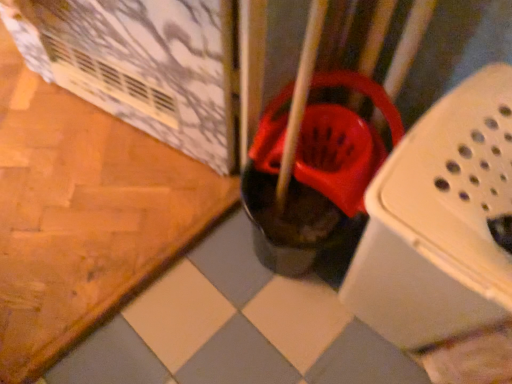
This screenshot has height=384, width=512. I want to click on white plastic laundry basket at center, so click(440, 221).

Describe the element at coordinates (440, 221) in the screenshot. I see `white plastic laundry basket at center` at that location.

In order to click on rubberized red bucket at center in this screenshot , I will do `click(308, 182)`.

Measure the distance between point (349,188) and camera.

The depth of point (349,188) is 33.58 inches.

This screenshot has width=512, height=384. What do you see at coordinates (308, 182) in the screenshot?
I see `rubberized red bucket at center` at bounding box center [308, 182].

Where is `white plastic laundry basket at center`? The width and height of the screenshot is (512, 384). white plastic laundry basket at center is located at coordinates (440, 221).

Is white plastic laundry basket at center at the left side of rubberized red bucket at center?

Incorrect, white plastic laundry basket at center is not on the left side of rubberized red bucket at center.

Which object is closer to the camera taking this photo, white plastic laundry basket at center or rubberized red bucket at center?

white plastic laundry basket at center is closer to the camera.

Which is in front, point (424, 221) or point (271, 217)?

The point (424, 221) is closer.

From the image's perspective, is white plastic laundry basket at center located beneath rubberized red bucket at center?

Indeed, from the image's perspective, white plastic laundry basket at center is shown beneath rubberized red bucket at center.

Based on the photo, from a real-world perspective, between white plastic laundry basket at center and rubberized red bucket at center, who is vertically lower?

In real-world perspective, rubberized red bucket at center is lower.

Does white plastic laundry basket at center have a lesser width compared to rubberized red bucket at center?

Yes, white plastic laundry basket at center is thinner than rubberized red bucket at center.

Considering the relative sizes of white plastic laundry basket at center and rubberized red bucket at center in the image provided, is white plastic laundry basket at center taller than rubberized red bucket at center?

Correct, white plastic laundry basket at center is much taller as rubberized red bucket at center.

Is white plastic laundry basket at center bigger than rubberized red bucket at center?

Indeed, white plastic laundry basket at center has a larger size compared to rubberized red bucket at center.

Is white plastic laundry basket at center outside of rubberized red bucket at center?

Indeed, white plastic laundry basket at center is completely outside rubberized red bucket at center.

Is white plastic laundry basket at center placed right next to rubberized red bucket at center?

No, white plastic laundry basket at center is not in contact with rubberized red bucket at center.

Is white plastic laundry basket at center looking in the opposite direction of rubberized red bucket at center?

No, white plastic laundry basket at center is not facing the opposite direction of rubberized red bucket at center.

This screenshot has width=512, height=384. I want to click on footwear to the left of white plastic laundry basket at center, so click(x=308, y=182).

Does rubberized red bucket at center appear on the left side of white plastic laundry basket at center?

Yes.

Is the position of rubberized red bucket at center more distant than that of white plastic laundry basket at center?

Yes, rubberized red bucket at center is behind white plastic laundry basket at center.

Between point (336, 166) and point (506, 313), which one is positioned behind?

Positioned behind is point (336, 166).

From the image's perspective, is rubberized red bucket at center above or below white plastic laundry basket at center?

Based on their image positions, rubberized red bucket at center is located above white plastic laundry basket at center.

From a real-world perspective, who is located lower, rubberized red bucket at center or white plastic laundry basket at center?

rubberized red bucket at center.

Is rubberized red bucket at center thinner than white plastic laundry basket at center?

Incorrect, the width of rubberized red bucket at center is not less than that of white plastic laundry basket at center.

Considering the relative sizes of rubberized red bucket at center and white plastic laundry basket at center in the image provided, is rubberized red bucket at center taller than white plastic laundry basket at center?

Incorrect, the height of rubberized red bucket at center is not larger of that of white plastic laundry basket at center.

Considering the sizes of objects rubberized red bucket at center and white plastic laundry basket at center in the image provided, who is bigger, rubberized red bucket at center or white plastic laundry basket at center?

With larger size is white plastic laundry basket at center.

Based on the photo, would you say rubberized red bucket at center is outside white plastic laundry basket at center?

Indeed, rubberized red bucket at center is completely outside white plastic laundry basket at center.

Are rubberized red bucket at center and white plastic laundry basket at center beside each other?

No, rubberized red bucket at center is not touching white plastic laundry basket at center.

Could you tell me if rubberized red bucket at center is turned towards white plastic laundry basket at center?

No, rubberized red bucket at center is not aimed at white plastic laundry basket at center.

What's the angular difference between rubberized red bucket at center and white plastic laundry basket at center's facing directions?

There is a 12-degree angle between the facing directions of rubberized red bucket at center and white plastic laundry basket at center.

You are a GUI agent. You are given a task and a screenshot of the screen. Output one action in this format:
    pyautogui.click(x=<x>, y=<y>)
    Task: Click on the footwear located on the left of white plastic laundry basket at center
    Image resolution: width=512 pixels, height=384 pixels.
    Given the screenshot: What is the action you would take?
    pyautogui.click(x=308, y=182)

You are a GUI agent. You are given a task and a screenshot of the screen. Output one action in this format:
    pyautogui.click(x=<x>, y=<y>)
    Task: Click on the box in front of the rubberized red bucket at center
    The width and height of the screenshot is (512, 384).
    Given the screenshot: What is the action you would take?
    pyautogui.click(x=440, y=221)

Identify the location of box on the right side of rubberized red bucket at center. The width and height of the screenshot is (512, 384). (440, 221).